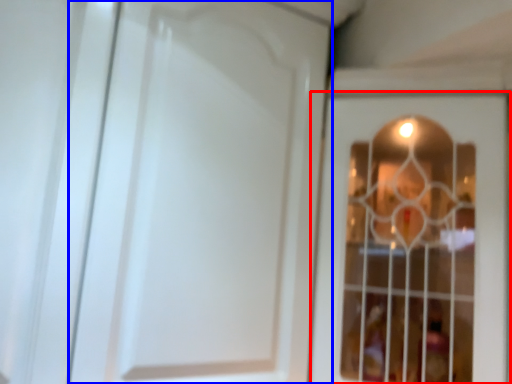
Question: Which of the following is the closest to the observer, door (highlighted by a red box) or door (highlighted by a blue box)?

Choices:
 (A) door
 (B) door

Answer: (A)